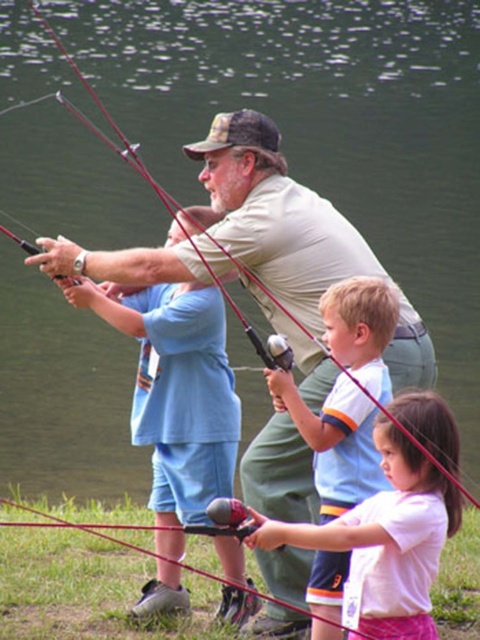
You are a photographer trying to capture a photo of the blue cotton shirt at center and the white cotton shirt at center. Which shirt should you focus on first if you want to include both in your shot without moving the camera?

You should focus on the white cotton shirt at center first because the blue cotton shirt at center is located below it, so adjusting the camera angle to include both would require framing from the top downward.

You are a photographer trying to capture a group photo of the white matte shirt at center and the white cotton shirt at center. Since you want both shirts to appear equally sized in the photo, which subject should you move closer to the camera?

The white matte shirt at center has a wider width than the white cotton shirt at center. To make them appear the same size in the photo, you should move the white matte shirt at center farther away from the camera or bring the white cotton shirt at center closer. This way, the size difference caused by their actual widths will be balanced by their distances from the camera.

You are a photographer trying to capture a clear shot of the white matte shirt at center and the white cotton shirt at center. Which shirt should you focus on first to ensure it appears sharp in the photo?

The white matte shirt at center has a smaller size compared to white cotton shirt at center, so you should focus on the white matte shirt at center first because it requires more precise focus due to its smaller size to ensure it appears sharp in the photo.